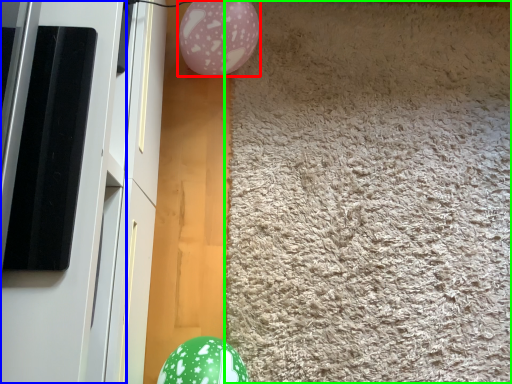
Question: Which object is positioned closest to balloon (highlighted by a red box)? Select from screen door (highlighted by a blue box) and mat (highlighted by a green box).

Choices:
 (A) screen door
 (B) mat

Answer: (B)